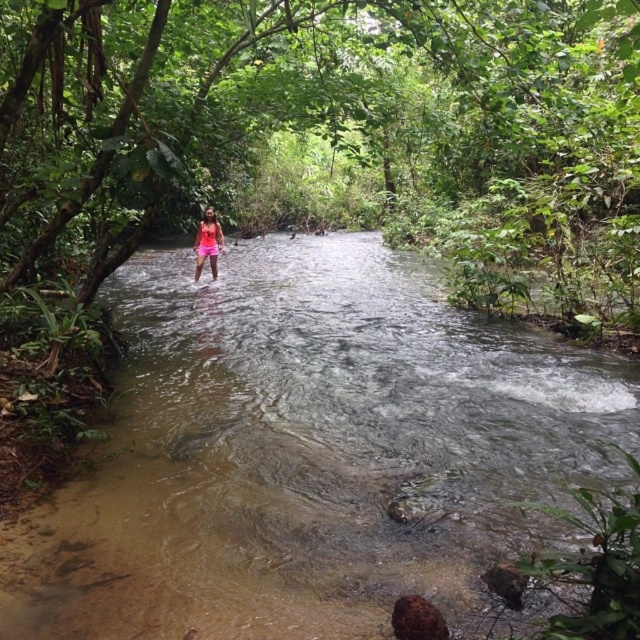
Question: Which of the following is the closest to the observer?

Choices:
 (A) (132, 566)
 (B) (204, 212)

Answer: (A)

Question: Which of the following is the closest to the observer?

Choices:
 (A) clear water stream at center
 (B) pink fabric at center

Answer: (A)

Question: Does clear water stream at center have a larger size compared to pink fabric at center?

Choices:
 (A) yes
 (B) no

Answer: (A)

Question: Which point is closer to the camera?

Choices:
 (A) (211, 272)
 (B) (282, 436)

Answer: (B)

Question: Does clear water stream at center have a larger size compared to pink fabric at center?

Choices:
 (A) yes
 (B) no

Answer: (A)

Question: From the image, what is the correct spatial relationship of clear water stream at center in relation to pink fabric at center?

Choices:
 (A) above
 (B) below

Answer: (B)